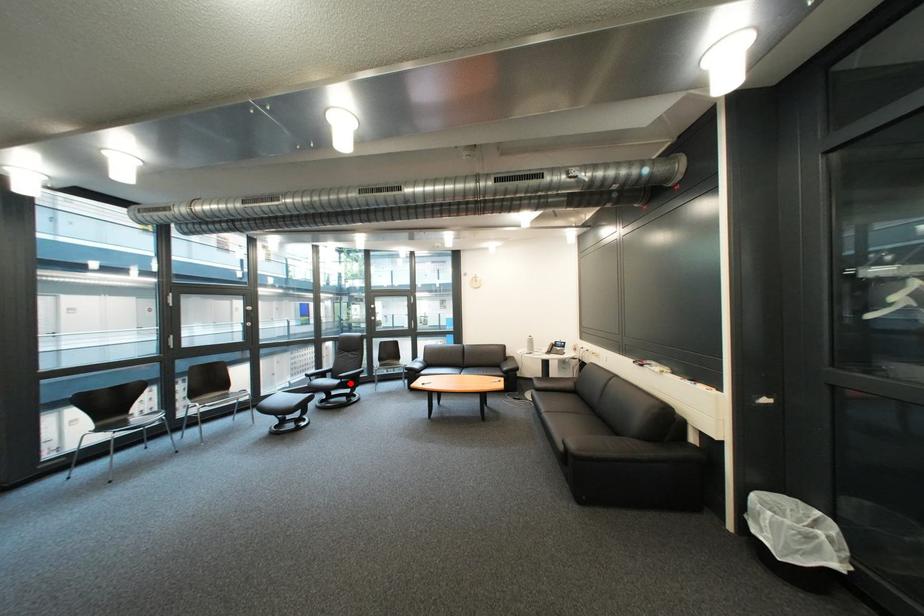
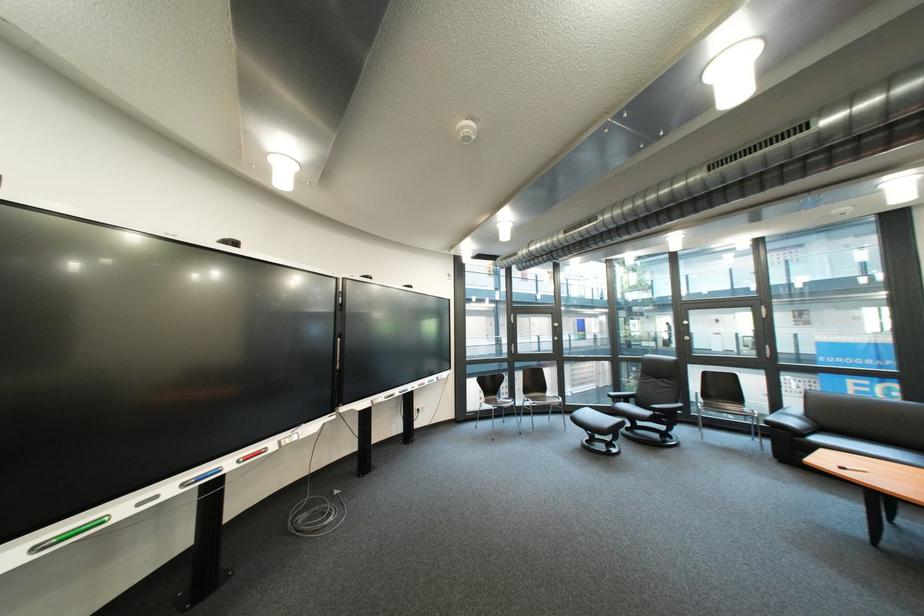
Question: I am providing you with two images of the same scene from different viewpoints. In image1, a red point is highlighted. Considering the same 3D point in image2, which of the following is correct?

Choices:
 (A) It is closer
 (B) It is farther

Answer: (B)